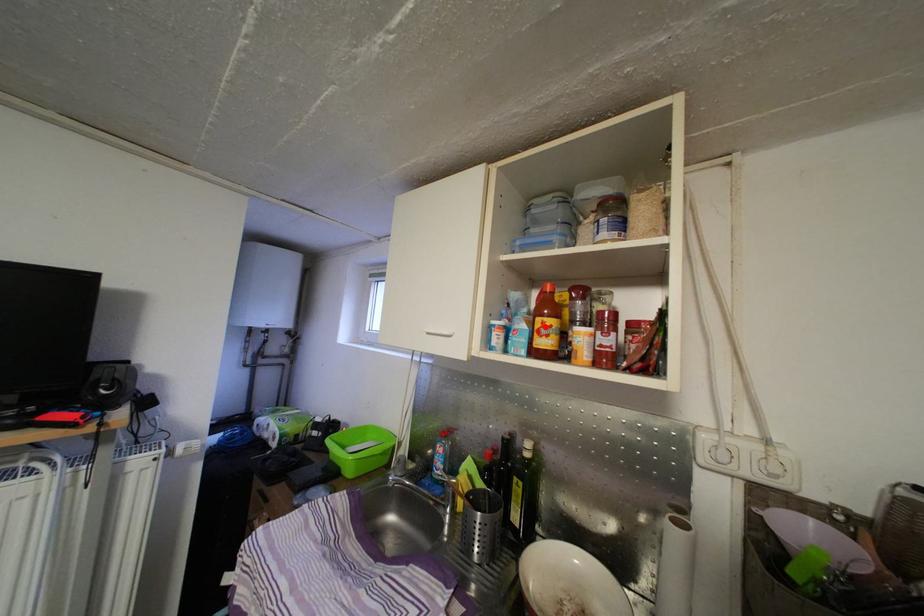
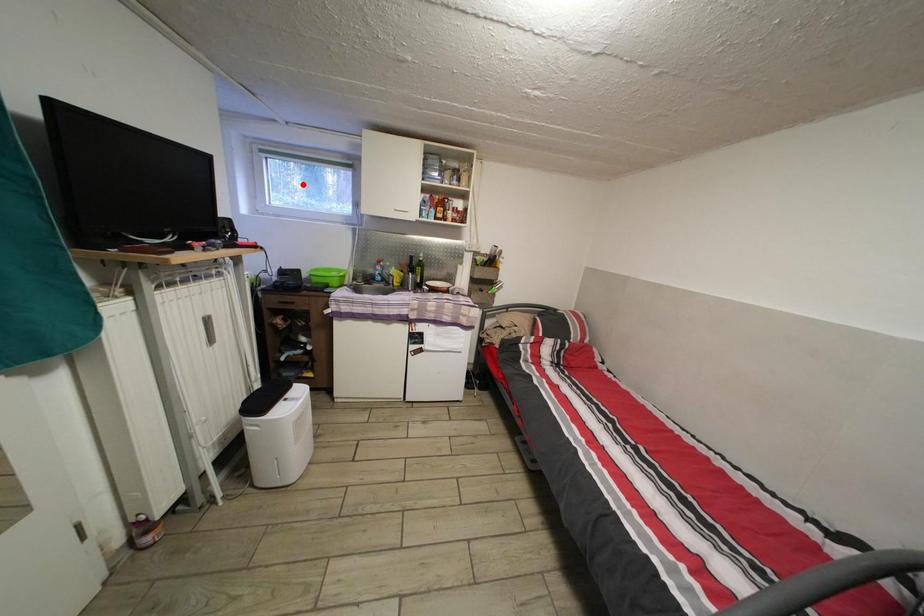
I am providing you with two images of the same scene from different viewpoints. A red point is marked on the first image and another point is marked on the second image. Does the point marked in image1 correspond to the same location as the one in image2?

No